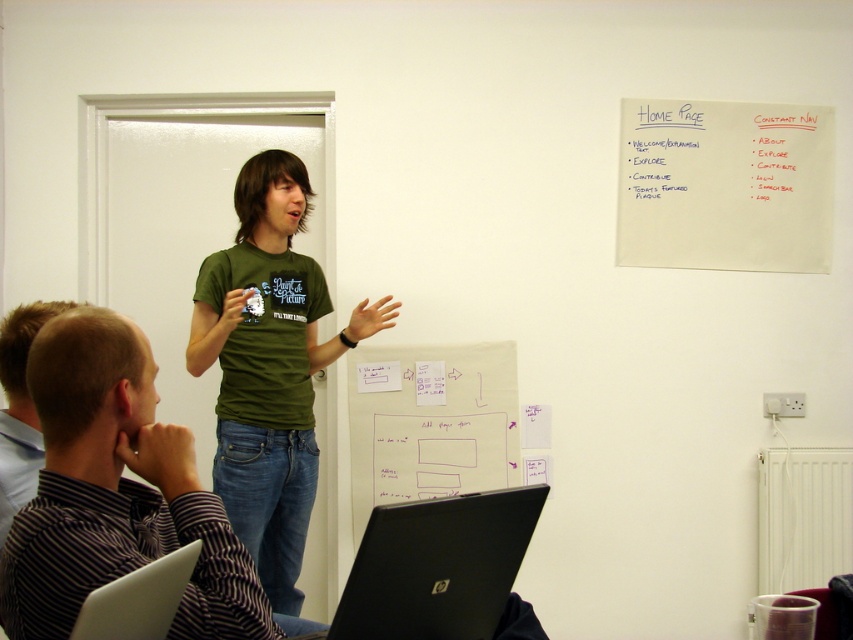
Where is the green matte shirt at center located in the image?

The green matte shirt at center is located at point 0.770 on the horizontal axis and 0.137 on the vertical axis.

You are sitting at the back of the room and want to see the screen of the black matte laptop at lower center. The green matte shirt at center is blocking your view. Can you move to the right side of the laptop to get a better view?

The green matte shirt at center is to the left of the black matte laptop at lower center, so moving to the right side of the laptop would allow you to see around the obstruction caused by the shirt.